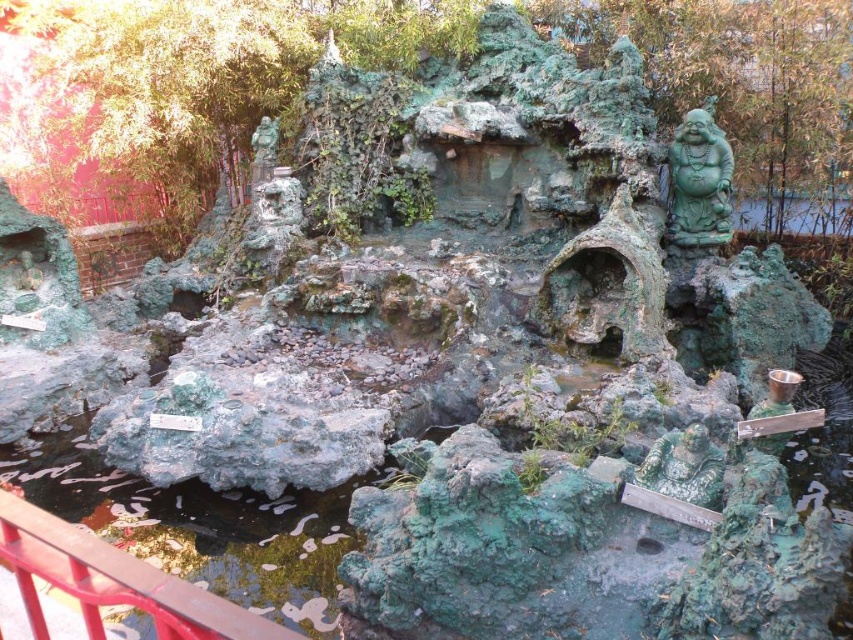
Which is more to the right, red metal railing at lower left or green patina statue at lower right?

green patina statue at lower right is more to the right.

This screenshot has height=640, width=853. What are the coordinates of `red metal railing at lower left` in the screenshot? It's located at tap(113, 580).

Find the location of a particular element. The image size is (853, 640). red metal railing at lower left is located at coordinates (113, 580).

What do you see at coordinates (699, 180) in the screenshot? The height and width of the screenshot is (640, 853). I see `green patina statue at upper right` at bounding box center [699, 180].

Which is below, green patina statue at upper right or green patina statue at lower right?

green patina statue at lower right is below.

Is point (682, 140) less distant than point (700, 461)?

No, (682, 140) is behind (700, 461).

At what (x,y) coordinates should I click in order to perform the action: click on green patina statue at upper right. Please return your answer as a coordinate pair (x, y). The image size is (853, 640). Looking at the image, I should click on (699, 180).

Describe the element at coordinates (113, 580) in the screenshot. I see `red metal railing at lower left` at that location.

Does red metal railing at lower left have a smaller size compared to green patina statue at upper right?

Yes.

Which is in front, point (138, 570) or point (677, 182)?

Point (138, 570)

Locate an element on the screen. This screenshot has height=640, width=853. red metal railing at lower left is located at coordinates (113, 580).